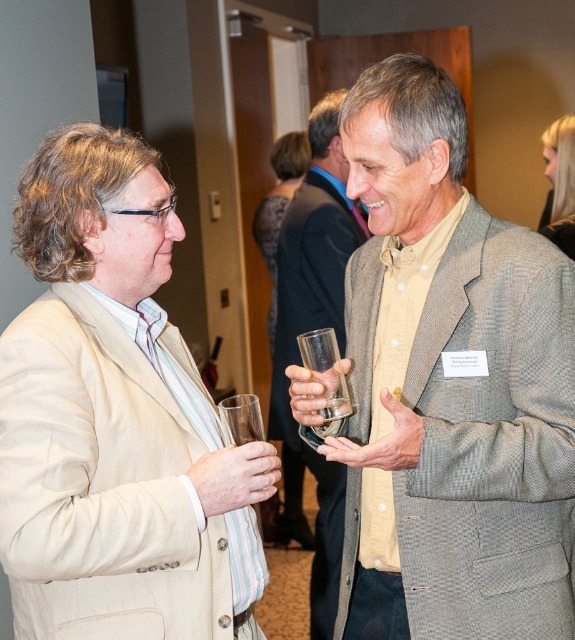
Question: Estimate the real-world distances between objects in this image. Which object is closer to the dark gray textured dress at center?

Choices:
 (A) matte glass at center
 (B) beige fabric suit at left

Answer: (A)

Question: Is beige fabric suit at left to the right of matte glass at center from the viewer's perspective?

Choices:
 (A) no
 (B) yes

Answer: (A)

Question: Can you confirm if beige fabric suit at left is bigger than matte glass at center?

Choices:
 (A) yes
 (B) no

Answer: (B)

Question: Estimate the real-world distances between objects in this image. Which object is farther from the matte glass at center?

Choices:
 (A) transparent glass at left
 (B) dark gray textured dress at center
 (C) transparent glass at center
 (D) beige fabric suit at left

Answer: (A)

Question: Based on their relative distances, which object is nearer to the matte glass at center?

Choices:
 (A) transparent glass at center
 (B) light gray textured coat at upper right
 (C) gray textured blazer at center
 (D) transparent glass at left

Answer: (B)

Question: Can you confirm if light gray textured coat at upper right is positioned to the right of transparent glass at left?

Choices:
 (A) no
 (B) yes

Answer: (B)